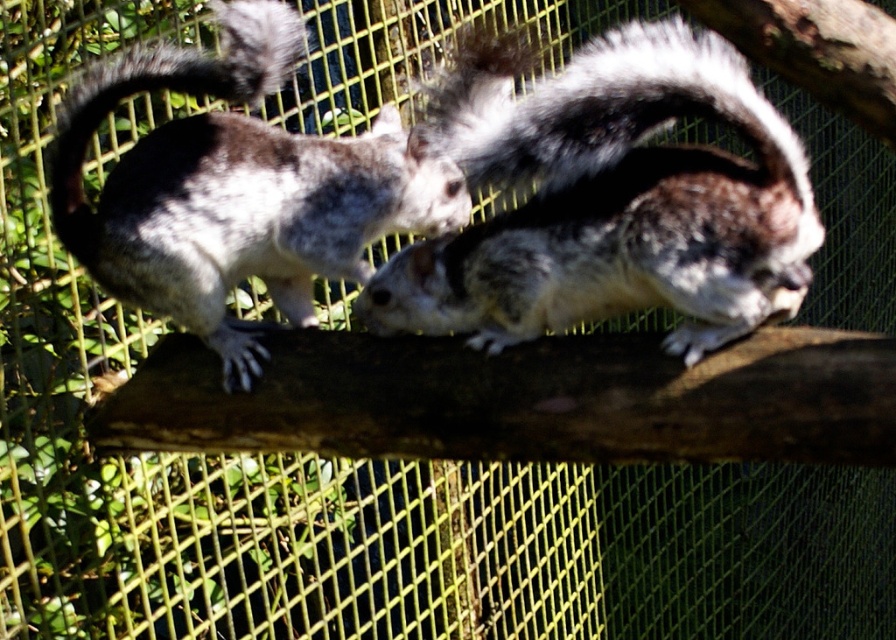
Is point (765, 262) less distant than point (393, 225)?

That is True.

Who is lower down, gray-furred squirrel at center or speckled fur squirrel at left?

gray-furred squirrel at center is lower down.

Does point (376, 289) come farther from viewer compared to point (326, 259)?

No, it is not.

Find the location of a particular element. The image size is (896, 640). gray-furred squirrel at center is located at coordinates pyautogui.click(x=610, y=198).

Is the position of speckled fur squirrel at left more distant than that of gray-furred tail at upper left?

No.

Is point (363, 186) more distant than point (91, 243)?

Yes, point (363, 186) is behind point (91, 243).

You are a GUI agent. You are given a task and a screenshot of the screen. Output one action in this format:
    pyautogui.click(x=<x>, y=<y>)
    Task: Click on the speckled fur squirrel at left
    The image size is (896, 640).
    Given the screenshot: What is the action you would take?
    pyautogui.click(x=237, y=186)

Does gray-furred squirrel at center appear on the left side of gray-furred tail at upper left?

No, gray-furred squirrel at center is not to the left of gray-furred tail at upper left.

Which is more to the right, gray-furred squirrel at center or gray-furred tail at upper left?

Positioned to the right is gray-furred squirrel at center.

The width and height of the screenshot is (896, 640). What are the coordinates of `gray-furred squirrel at center` in the screenshot? It's located at (610, 198).